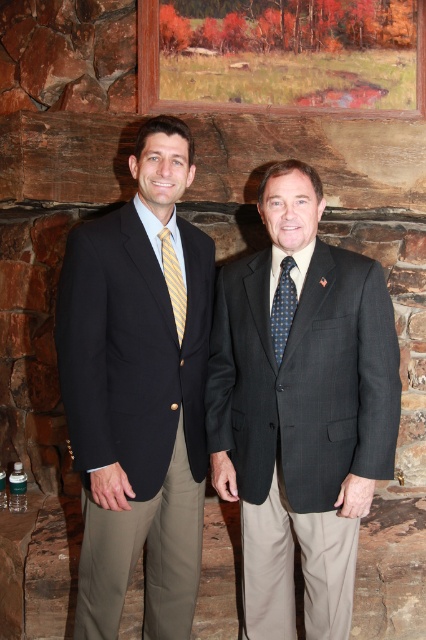
Question: Estimate the real-world distances between objects in this image. Which object is closer to the dark gray pinstripe suit at center?

Choices:
 (A) yellow striped tie at center
 (B) dark blue dotted tie at center

Answer: (B)

Question: Observing the image, what is the correct spatial positioning of dark gray pinstripe suit at center in reference to yellow striped tie at center?

Choices:
 (A) left
 (B) right

Answer: (B)

Question: Where is dark gray pinstripe suit at center located in relation to dark blue dotted tie at center in the image?

Choices:
 (A) right
 (B) left

Answer: (A)

Question: Which point appears farthest from the camera in this image?

Choices:
 (A) (164, 244)
 (B) (351, 582)
 (C) (420, 56)

Answer: (C)

Question: Which point is closer to the camera?

Choices:
 (A) dark gray pinstripe suit at center
 (B) yellow striped tie at center
 (C) black textured suit at center

Answer: (C)

Question: Can you confirm if black textured suit at center is smaller than dark gray pinstripe suit at center?

Choices:
 (A) no
 (B) yes

Answer: (A)